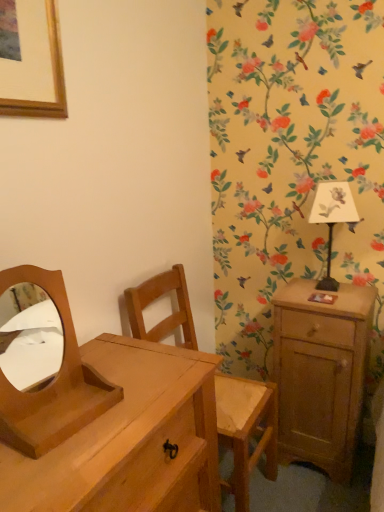
Locate an element on the screen. The width and height of the screenshot is (384, 512). vacant area in front of wooden/matte mirror at left is located at coordinates (52, 470).